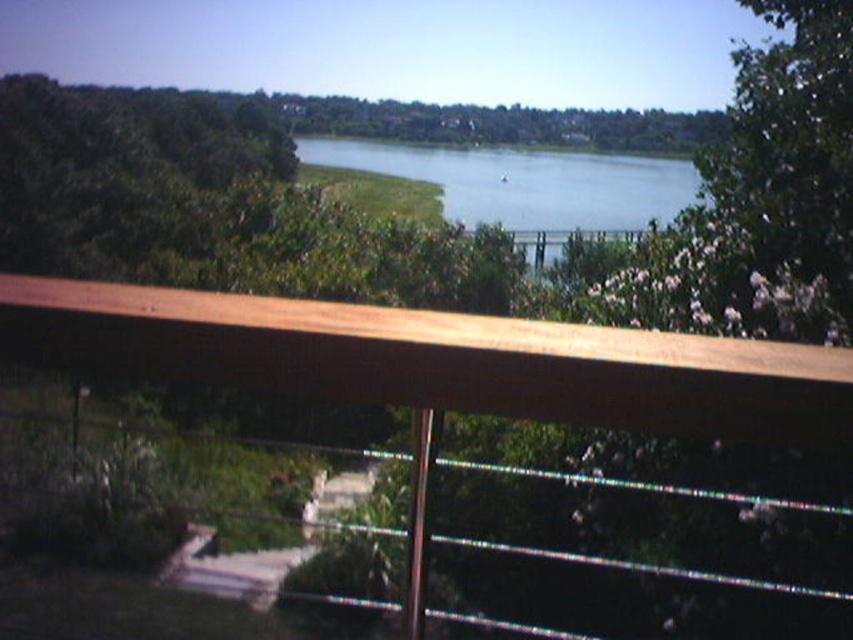
You are standing on a balcony and want to take a photo of the wooden railing at upper center. If your camera can focus on objects up to 5 feet away, will it be able to capture the railing clearly?

The wooden railing at upper center is 4.21 feet from the camera, which is within the camera focus range of up to 5 feet. Therefore, the camera can capture the railing clearly.

You are standing on the balcony looking out. There are two points marked in the scene. Which point is closer to you, point (9, 284) or point (653, 198)?

Point (9, 284) is closer to the viewer than point (653, 198).